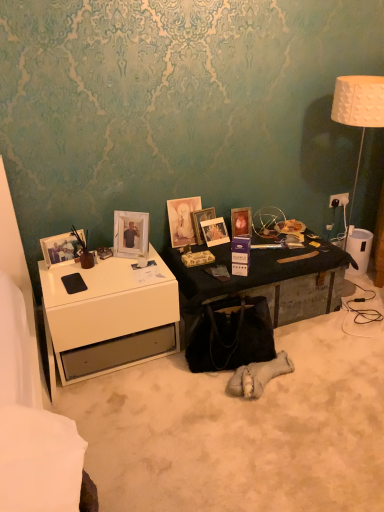
Question: Is wooden photo frame at center, the 2th picture frame positioned from the right, outside of black suede handbag at center?

Choices:
 (A) no
 (B) yes

Answer: (B)

Question: Is wooden photo frame at center, the fifth picture frame positioned from the left, oriented towards black suede handbag at center?

Choices:
 (A) no
 (B) yes

Answer: (B)

Question: Is there a large distance between wooden photo frame at center, the fifth picture frame positioned from the left, and black suede handbag at center?

Choices:
 (A) no
 (B) yes

Answer: (A)

Question: Is wooden photo frame at center, the fifth picture frame positioned from the left, taller than black suede handbag at center?

Choices:
 (A) no
 (B) yes

Answer: (A)

Question: Is the position of wooden photo frame at center, the 2th picture frame positioned from the right, more distant than that of black suede handbag at center?

Choices:
 (A) yes
 (B) no

Answer: (A)

Question: Is matte wooden picture frame at center, arranged as the 6th picture frame when viewed from the left, in front of or behind white glossy picture frame at upper left, arranged as the second picture frame when viewed from the left, in the image?

Choices:
 (A) front
 (B) behind

Answer: (B)

Question: Visually, is matte wooden picture frame at center, arranged as the 6th picture frame when viewed from the left, positioned to the left or to the right of white glossy picture frame at upper left, arranged as the second picture frame when viewed from the left?

Choices:
 (A) right
 (B) left

Answer: (A)

Question: Is matte wooden picture frame at center, arranged as the 6th picture frame when viewed from the left, taller or shorter than white glossy picture frame at upper left, which is the 5th picture frame from right to left?

Choices:
 (A) short
 (B) tall

Answer: (A)

Question: From a real-world perspective, is matte wooden picture frame at center, arranged as the 6th picture frame when viewed from the left, above or below white glossy picture frame at upper left, which is the 5th picture frame from right to left?

Choices:
 (A) above
 (B) below

Answer: (B)

Question: Which is correct: white plastic power outlet at upper right is inside white glossy picture frame at upper left, arranged as the second picture frame when viewed from the left, or outside of it?

Choices:
 (A) outside
 (B) inside

Answer: (A)

Question: From their relative heights in the image, would you say white plastic power outlet at upper right is taller or shorter than white glossy picture frame at upper left, arranged as the second picture frame when viewed from the left?

Choices:
 (A) tall
 (B) short

Answer: (B)

Question: Based on their positions, is white plastic power outlet at upper right located to the left or right of white glossy picture frame at upper left, arranged as the second picture frame when viewed from the left?

Choices:
 (A) left
 (B) right

Answer: (B)

Question: From a real-world perspective, relative to white glossy picture frame at upper left, arranged as the second picture frame when viewed from the left, is white plastic power outlet at upper right vertically above or below?

Choices:
 (A) above
 (B) below

Answer: (B)

Question: Looking at their shapes, would you say white plastic power outlet at upper right is wider or thinner than matte glass picture frame at center, which is counted as the fourth picture frame, starting from the right?

Choices:
 (A) thin
 (B) wide

Answer: (A)

Question: From the image's perspective, relative to matte glass picture frame at center, marked as the 3th picture frame in a left-to-right arrangement, is white plastic power outlet at upper right above or below?

Choices:
 (A) below
 (B) above

Answer: (B)